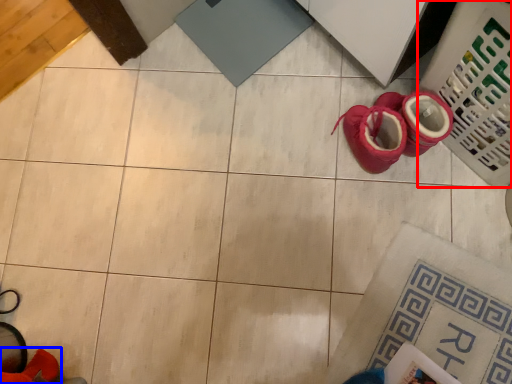
Question: Which point is further to the camera, laundry basket (highlighted by a red box) or footwear (highlighted by a blue box)?

Choices:
 (A) laundry basket
 (B) footwear

Answer: (A)